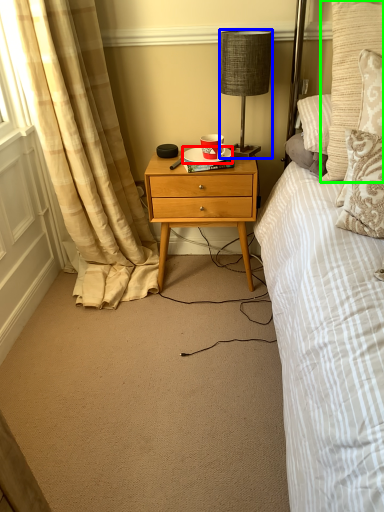
Question: Estimate the real-world distances between objects in this image. Which object is closer to plate (highlighted by a red box), lamp (highlighted by a blue box) or pillow (highlighted by a green box)?

Choices:
 (A) lamp
 (B) pillow

Answer: (A)